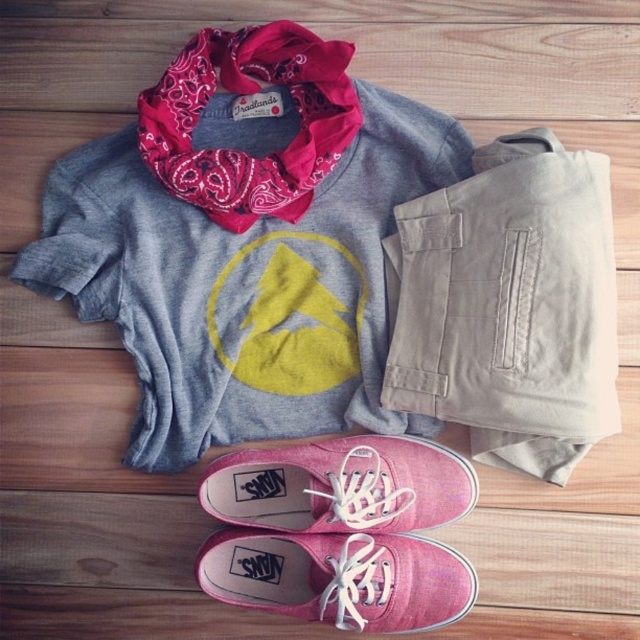
Is point (372, 365) farther from viewer compared to point (464, 413)?

That is True.

Describe the element at coordinates (243, 285) in the screenshot. I see `matte gray sweatshirt with yellow graphic at center` at that location.

You are a GUI agent. You are given a task and a screenshot of the screen. Output one action in this format:
    pyautogui.click(x=<x>, y=<y>)
    Task: Click on the matte gray sweatshirt with yellow graphic at center
    
    Given the screenshot: What is the action you would take?
    pyautogui.click(x=243, y=285)

Can you confirm if matte gray sweatshirt with yellow graphic at center is positioned above pink canvas sneakers at lower center?

Indeed, matte gray sweatshirt with yellow graphic at center is positioned over pink canvas sneakers at lower center.

Locate an element on the screen. matte gray sweatshirt with yellow graphic at center is located at coordinates (243, 285).

Is khaki cotton pants at center-right positioned in front of pink canvas shoe at lower center?

Yes.

Does point (564, 269) come farther from viewer compared to point (435, 625)?

No, it is not.

The width and height of the screenshot is (640, 640). I want to click on khaki cotton pants at center-right, so click(x=509, y=305).